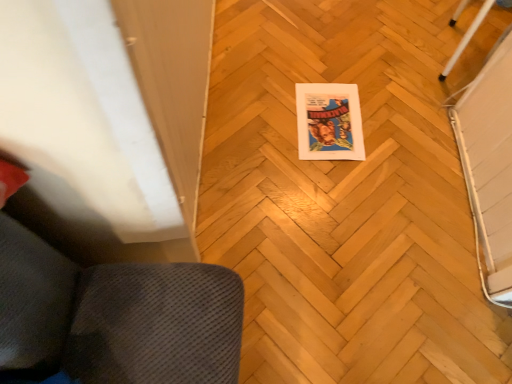
Question: Is matte paper comic book at center taller than white glossy pole at upper right?

Choices:
 (A) no
 (B) yes

Answer: (A)

Question: Is matte paper comic book at center in front of white glossy pole at upper right?

Choices:
 (A) no
 (B) yes

Answer: (A)

Question: Does matte paper comic book at center have a larger size compared to white glossy pole at upper right?

Choices:
 (A) yes
 (B) no

Answer: (B)

Question: Can you confirm if matte paper comic book at center is positioned to the right of white glossy pole at upper right?

Choices:
 (A) yes
 (B) no

Answer: (B)

Question: Is matte paper comic book at center not inside white glossy pole at upper right?

Choices:
 (A) no
 (B) yes

Answer: (B)

Question: Can you confirm if matte paper comic book at center is positioned to the left of white glossy pole at upper right?

Choices:
 (A) yes
 (B) no

Answer: (A)

Question: Is matte paper comic book at center further to the viewer compared to wooden parquet floor at center?

Choices:
 (A) yes
 (B) no

Answer: (A)

Question: Are matte paper comic book at center and wooden parquet floor at center located far from each other?

Choices:
 (A) no
 (B) yes

Answer: (A)

Question: Is wooden parquet floor at center a part of matte paper comic book at center?

Choices:
 (A) yes
 (B) no

Answer: (B)

Question: From the image's perspective, does matte paper comic book at center appear lower than wooden parquet floor at center?

Choices:
 (A) no
 (B) yes

Answer: (B)

Question: From the image's perspective, is matte paper comic book at center located above wooden parquet floor at center?

Choices:
 (A) yes
 (B) no

Answer: (B)

Question: Does matte paper comic book at center have a larger size compared to wooden parquet floor at center?

Choices:
 (A) yes
 (B) no

Answer: (B)

Question: Is the depth of white glossy pole at upper right greater than that of wooden parquet floor at center?

Choices:
 (A) yes
 (B) no

Answer: (A)